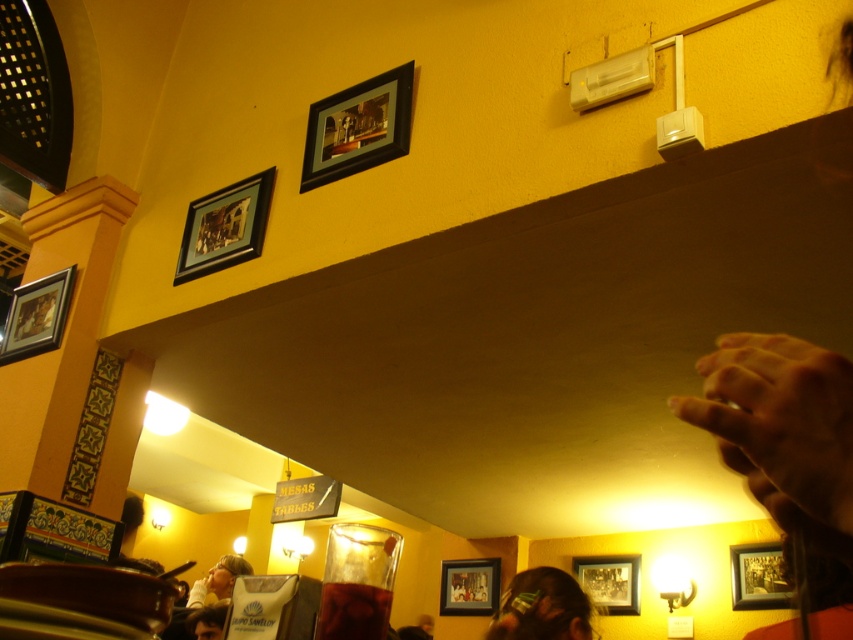
You are a customer sitting at a table in the restaurant. You notice two points marked in the scene. One is at coordinates point (219, 248) and the other is at point (763, 582). Which point is closer to your current position?

Point (219, 248) is in front of point (763, 582), so it is closer to your current position.

You are a photographer standing in the restaurant and want to take a photo of the matte black picture frame at upper left. The camera you are using has a focal length of 50mm. If the frame is at point (224, 227) in the image coordinates, what is the angle of view required to ensure the entire matte black picture frame at upper left fits in the photo?

The angle of view required to capture the entire matte black picture frame at upper left depends on the camera sensor size and the distance to the frame. However, since the frame is located at point (224, 227) in the image coordinates, you can adjust the camera position or zoom level to ensure it fits within the frame.

You are a customer sitting at a table in the restaurant and want to hang a new picture frame between the wooden picture frame at lower center and the wooden picture frame at lower right. Based on their positions, which frame should you place your new frame closer to?

The wooden picture frame at lower center is below the wooden picture frame at lower right. To hang the new frame between them, you should place it closer to the wooden picture frame at lower center since it is positioned lower than the other frame.